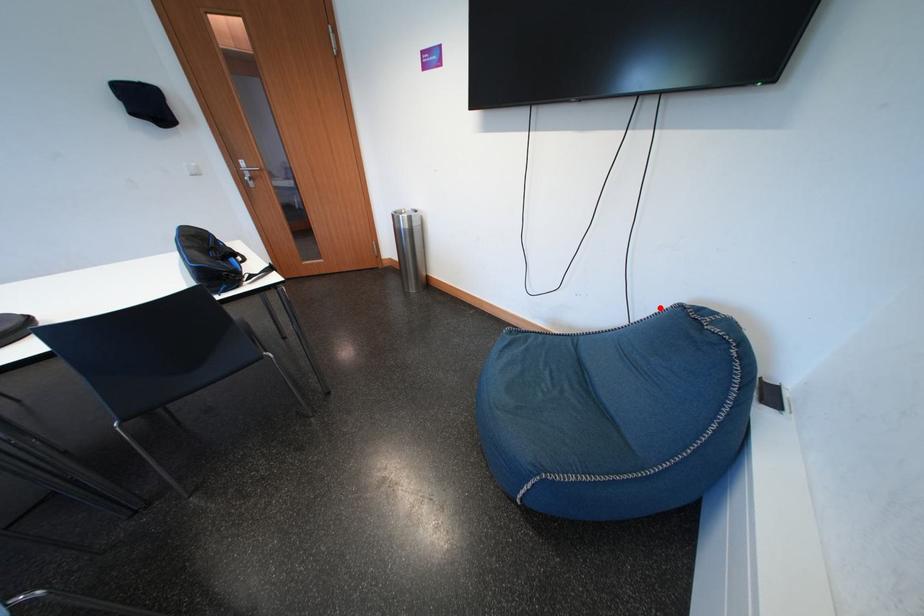
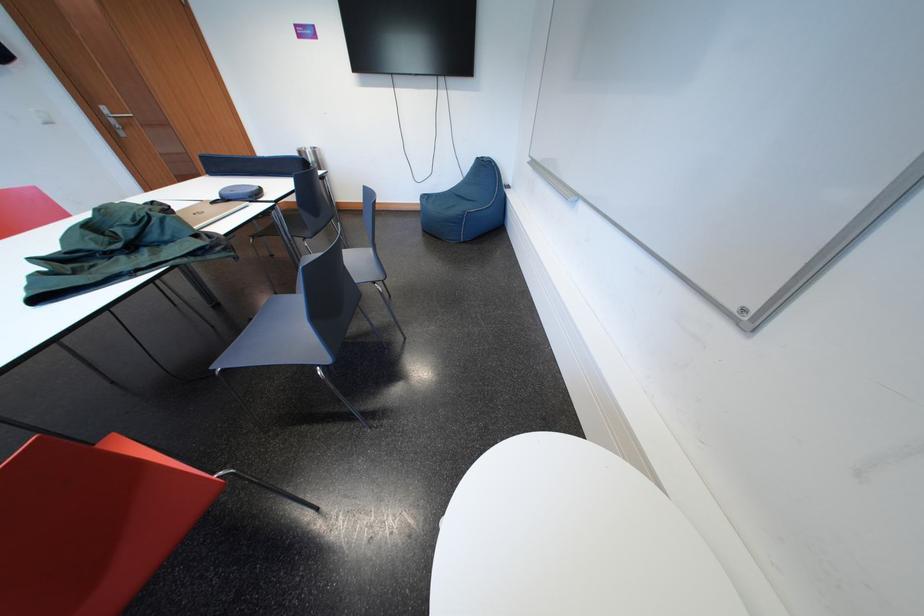
Find the pixel in the second image that matches the highlighted location in the first image.

(477, 169)